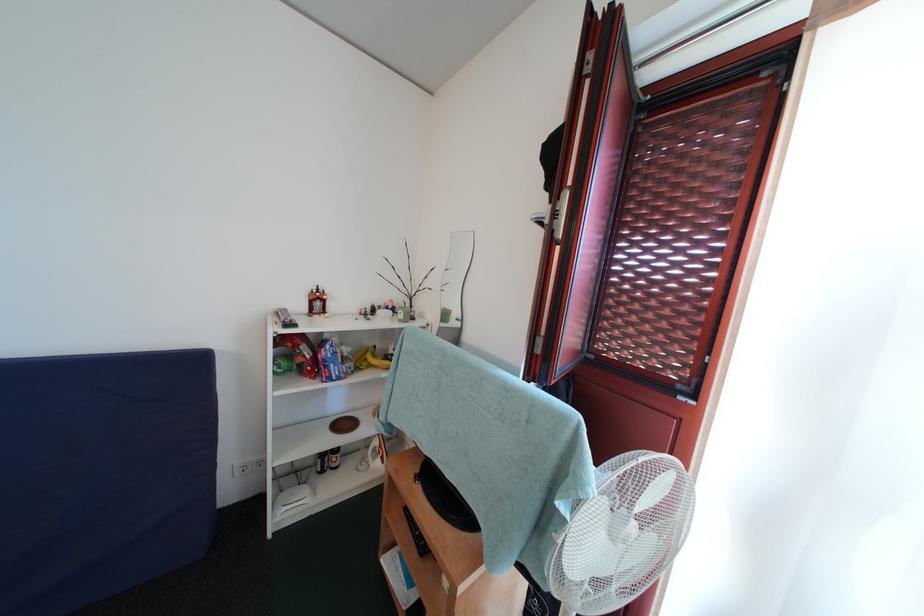
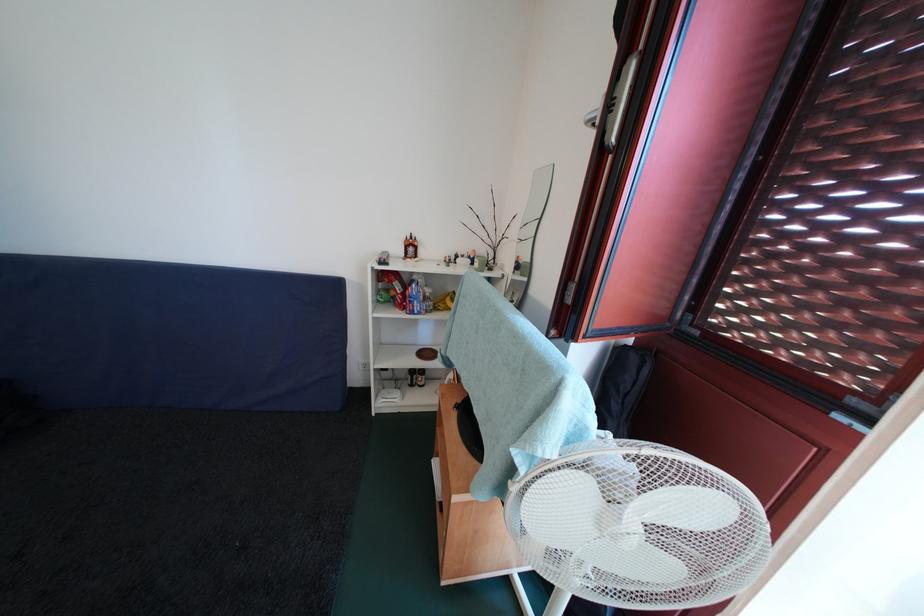
In the second image, find the point that corresponds to [350,430] in the first image.

(433, 359)